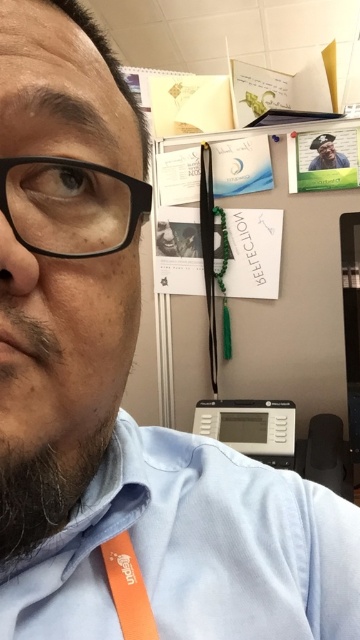
From the picture: Who is shorter, light blue cotton dress shirt at lower left or matte black photo frame at upper center?

Standing shorter between the two is matte black photo frame at upper center.

Locate an element on the screen. The height and width of the screenshot is (640, 360). light blue cotton dress shirt at lower left is located at coordinates (194, 548).

Does point (56, 204) lie in front of point (330, 150)?

Yes, point (56, 204) is in front of point (330, 150).

Does black plastic glasses at left have a smaller size compared to matte black photo frame at upper center?

Yes, black plastic glasses at left is smaller than matte black photo frame at upper center.

At what (x,y) coordinates should I click in order to perform the action: click on black plastic glasses at left. Please return your answer as a coordinate pair (x, y). This screenshot has width=360, height=640. Looking at the image, I should click on (70, 205).

Can you confirm if black plastic glasses at left is smaller than orange fabric tag at lower left?

Actually, black plastic glasses at left might be larger than orange fabric tag at lower left.

Locate an element on the screen. black plastic glasses at left is located at coordinates (70, 205).

You are a GUI agent. You are given a task and a screenshot of the screen. Output one action in this format:
    pyautogui.click(x=<x>, y=<y>)
    Task: Click on the black plastic glasses at left
    
    Given the screenshot: What is the action you would take?
    pyautogui.click(x=70, y=205)